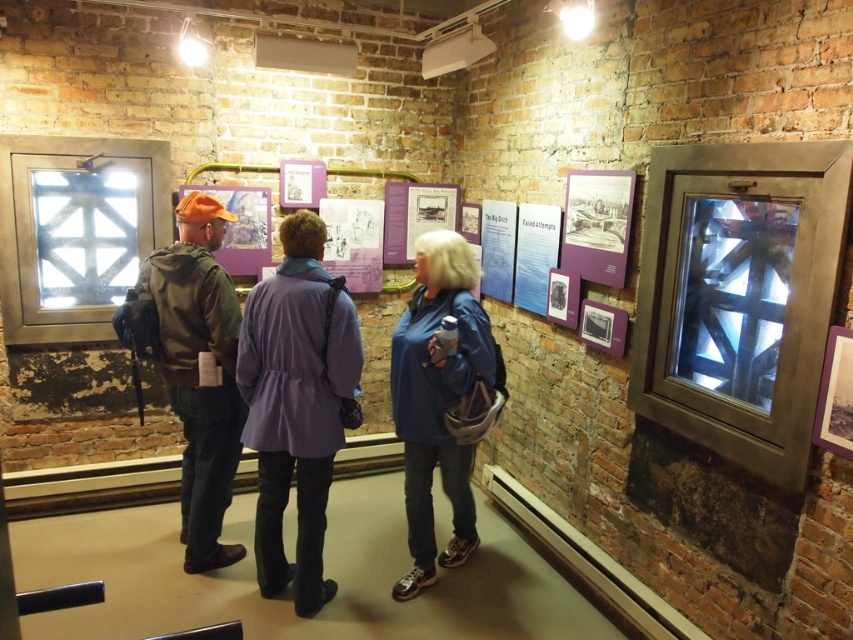
Question: Does blue fabric coat at center lie behind green matte jacket at center?

Choices:
 (A) no
 (B) yes

Answer: (A)

Question: Which of the following is the closest to the observer?

Choices:
 (A) purple fabric coat at center
 (B) blue fabric jacket at center

Answer: (A)

Question: Is blue fabric coat at center closer to the viewer compared to green matte jacket at center?

Choices:
 (A) no
 (B) yes

Answer: (B)

Question: Does blue fabric coat at center appear under blue fabric jacket at center?

Choices:
 (A) yes
 (B) no

Answer: (B)

Question: Which point is closer to the camera?

Choices:
 (A) (334, 588)
 (B) (234, 440)
 (C) (186, 268)

Answer: (C)

Question: Which point is farther to the camera?

Choices:
 (A) (320, 264)
 (B) (155, 276)
 (C) (486, 408)
 (D) (194, 320)

Answer: (B)